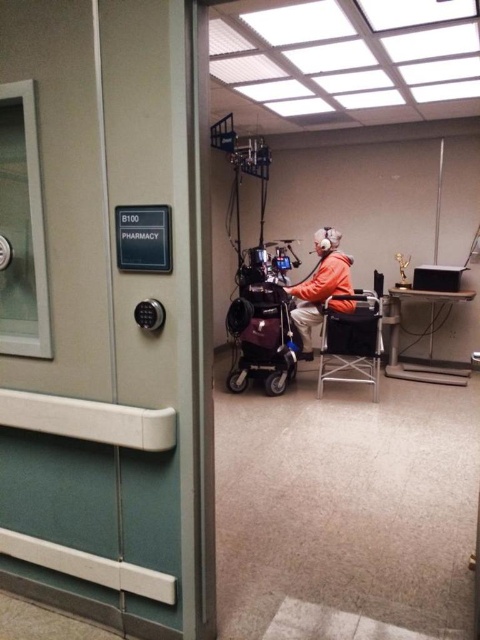
Is metallic folding chair at center smaller than orange fleece jacket at center?

Actually, metallic folding chair at center might be larger than orange fleece jacket at center.

Does metallic folding chair at center lie behind orange fleece jacket at center?

No, it is in front of orange fleece jacket at center.

This screenshot has height=640, width=480. Find the location of `metallic folding chair at center`. metallic folding chair at center is located at coordinates (351, 342).